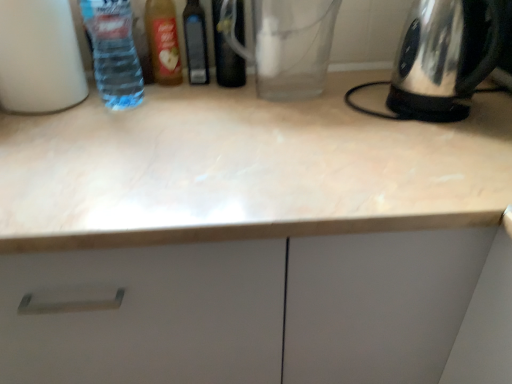
Question: Should I look upward or downward to see transparent glass coffee pot at center?

Choices:
 (A) down
 (B) up

Answer: (B)

Question: Is white marble countertop at center aimed at translucent plastic bottle at upper left, positioned as the 2th bottle in left-to-right order?

Choices:
 (A) no
 (B) yes

Answer: (A)

Question: Is white marble countertop at center closer to the viewer compared to translucent plastic bottle at upper left, which appears as the 4th bottle when viewed from the right?

Choices:
 (A) yes
 (B) no

Answer: (A)

Question: Is white marble countertop at center behind translucent plastic bottle at upper left, positioned as the 2th bottle in left-to-right order?

Choices:
 (A) no
 (B) yes

Answer: (A)

Question: Can you confirm if white marble countertop at center is taller than translucent plastic bottle at upper left, which appears as the 4th bottle when viewed from the right?

Choices:
 (A) no
 (B) yes

Answer: (B)

Question: From the image's perspective, does white marble countertop at center appear higher than translucent plastic bottle at upper left, positioned as the 2th bottle in left-to-right order?

Choices:
 (A) no
 (B) yes

Answer: (A)

Question: Is white marble countertop at center outside translucent plastic bottle at upper left, positioned as the 2th bottle in left-to-right order?

Choices:
 (A) no
 (B) yes

Answer: (B)

Question: Considering the relative sizes of white matte bottle at left, the 1th bottle viewed from the left, and white marble countertop at center in the image provided, is white matte bottle at left, the 1th bottle viewed from the left, shorter than white marble countertop at center?

Choices:
 (A) yes
 (B) no

Answer: (A)

Question: Is the surface of white matte bottle at left, the 5th bottle positioned from the right, in direct contact with white marble countertop at center?

Choices:
 (A) yes
 (B) no

Answer: (B)

Question: Is the position of white matte bottle at left, the 1th bottle viewed from the left, more distant than that of white marble countertop at center?

Choices:
 (A) yes
 (B) no

Answer: (A)

Question: Is white matte bottle at left, the 5th bottle positioned from the right, to the right of white marble countertop at center from the viewer's perspective?

Choices:
 (A) yes
 (B) no

Answer: (B)

Question: Does white matte bottle at left, the 5th bottle positioned from the right, lie in front of white marble countertop at center?

Choices:
 (A) yes
 (B) no

Answer: (B)

Question: Is white matte bottle at left, the 1th bottle viewed from the left, bigger than white marble countertop at center?

Choices:
 (A) yes
 (B) no

Answer: (B)

Question: From a real-world perspective, is translucent plastic bottle at upper left, which appears as the 4th bottle when viewed from the right, positioned over transparent glass bottle at center, marked as the first bottle in a right-to-left arrangement, based on gravity?

Choices:
 (A) yes
 (B) no

Answer: (A)